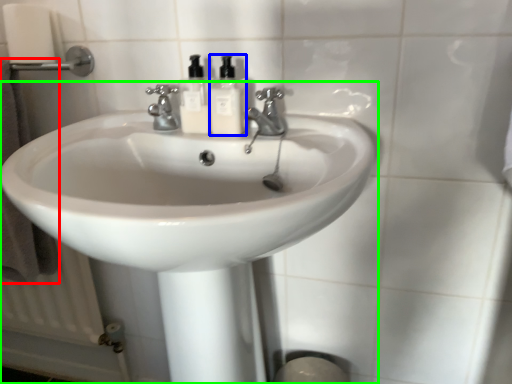
Question: Which object is positioned farthest from bath towel (highlighted by a red box)? Select from soap dispenser (highlighted by a blue box) and sink (highlighted by a green box).

Choices:
 (A) soap dispenser
 (B) sink

Answer: (A)